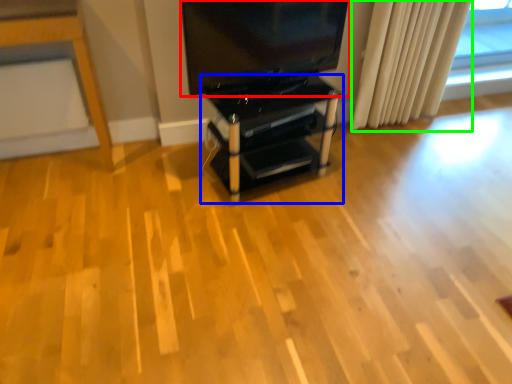
Question: Based on their relative distances, which object is farther from television (highlighted by a red box)? Choose from furniture (highlighted by a blue box) and curtain (highlighted by a green box).

Choices:
 (A) furniture
 (B) curtain

Answer: (B)